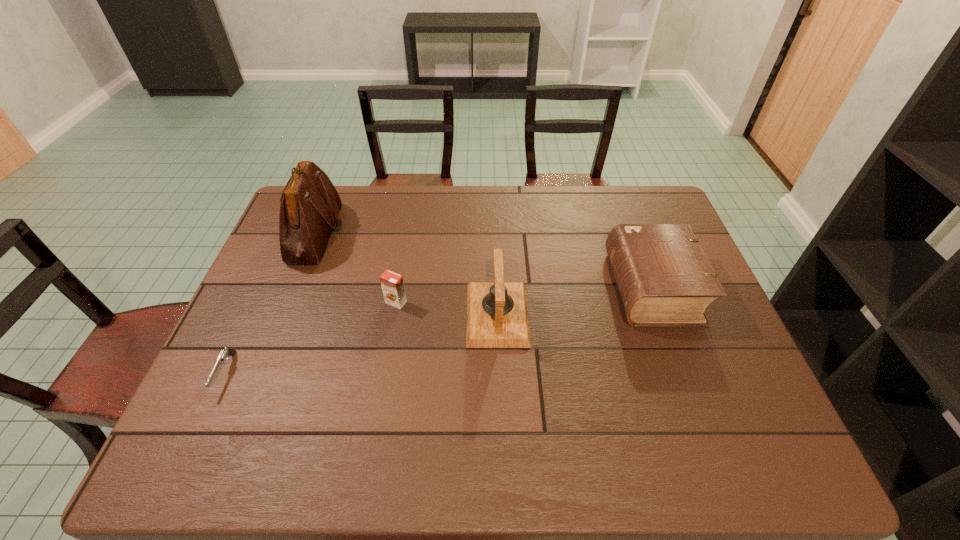
I want to click on free area in between the orange juice and the shortest object, so click(311, 338).

Locate an element on the screen. free spot between the pistol and the orange juice is located at coordinates (311, 338).

Where is `unoccupied position between the Bible and the tallest object`? The width and height of the screenshot is (960, 540). unoccupied position between the Bible and the tallest object is located at coordinates (485, 260).

This screenshot has height=540, width=960. In order to click on free space between the second object from right to left and the rightmost object in this screenshot , I will do `click(575, 301)`.

Select which object appears as the second closest to the Bible. Please provide its 2D coordinates. Your answer should be formatted as a tuple, i.e. [(x, y)], where the tuple contains the x and y coordinates of a point satisfying the conditions above.

[(392, 284)]

Image resolution: width=960 pixels, height=540 pixels. Identify the location of the closest object to the orange juice. (497, 316).

Image resolution: width=960 pixels, height=540 pixels. Identify the location of vacant space that satisfies the following two spatial constraints: 1. on the front side of the third object from right to left; 2. on the right side of the second tallest object. (394, 314).